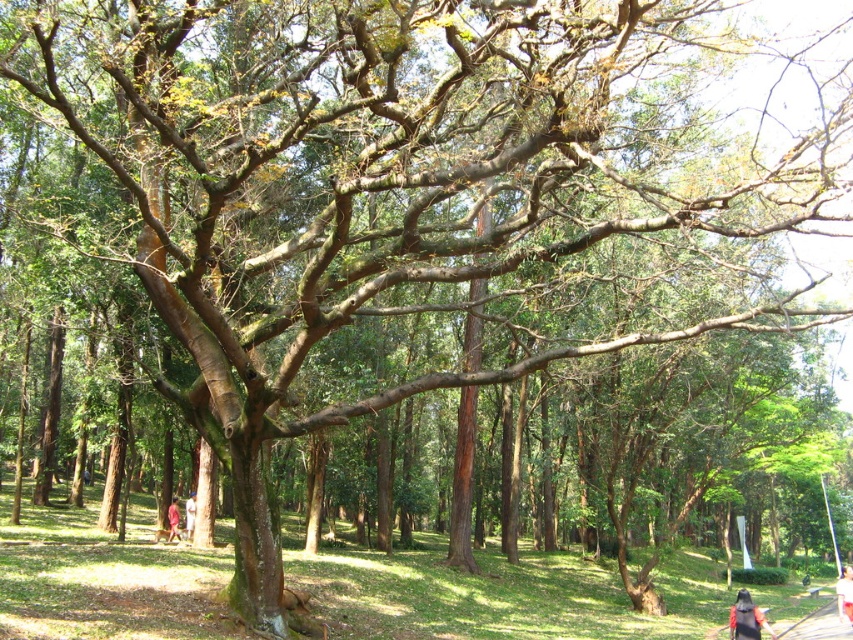
Measure the distance between point (836, 592) and camera.

Point (836, 592) is 31.40 meters from camera.

Does white cotton shirt at center appear over light brown fabric jacket at lower center?

No.

Who is more distant from viewer, (x=839, y=586) or (x=184, y=531)?

The point (x=184, y=531) is behind.

I want to click on white cotton shirt at center, so click(x=845, y=593).

Where is `dark blue shirt at lower right`? This screenshot has height=640, width=853. dark blue shirt at lower right is located at coordinates pos(746,618).

Between dark blue shirt at lower right and red fabric person at lower left, which one has more height?

dark blue shirt at lower right is taller.

You are a GUI agent. You are given a task and a screenshot of the screen. Output one action in this format:
    pyautogui.click(x=<x>, y=<y>)
    Task: Click on the dark blue shirt at lower right
    The height and width of the screenshot is (640, 853).
    Given the screenshot: What is the action you would take?
    pyautogui.click(x=746, y=618)

Is dark blue shirt at lower right wider than white cotton shirt at center?

Incorrect, dark blue shirt at lower right's width does not surpass white cotton shirt at center's.

Between dark blue shirt at lower right and white cotton shirt at center, which one is positioned lower?

white cotton shirt at center

Find the location of a particular element. This screenshot has height=640, width=853. dark blue shirt at lower right is located at coordinates (746, 618).